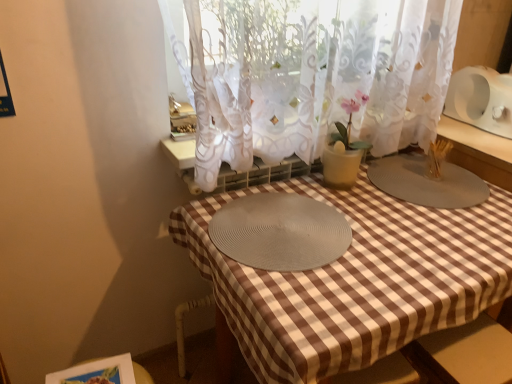
Find the location of `white sheer curtain at center`. white sheer curtain at center is located at coordinates (314, 75).

Is gray matte placemat at center, the first glass plate positioned from the right, closer to the viewer compared to gray woven placemat at center, placed as the second glass plate when sorted from right to left?

No, gray matte placemat at center, the first glass plate positioned from the right, is further to the viewer.

From the image's perspective, is gray matte placemat at center, which ranks as the second glass plate in left-to-right order, located above gray woven placemat at center, positioned as the 1th glass plate in left-to-right order?

Yes.

Which object is thinner, gray matte placemat at center, which ranks as the second glass plate in left-to-right order, or gray woven placemat at center, positioned as the 1th glass plate in left-to-right order?

gray woven placemat at center, positioned as the 1th glass plate in left-to-right order, is thinner.

Locate an element on the screen. glass plate behind the gray woven placemat at center, placed as the second glass plate when sorted from right to left is located at coordinates (426, 182).

Is gray matte placemat at center, which ranks as the second glass plate in left-to-right order, smaller than white sheer curtain at center?

Yes.

In terms of width, does gray matte placemat at center, the first glass plate positioned from the right, look wider or thinner when compared to white sheer curtain at center?

In the image, gray matte placemat at center, the first glass plate positioned from the right, appears to be wider than white sheer curtain at center.

Based on the photo, is gray matte placemat at center, which ranks as the second glass plate in left-to-right order, located outside white sheer curtain at center?

Yes, gray matte placemat at center, which ranks as the second glass plate in left-to-right order, is not within white sheer curtain at center.

Consider the image. From the image's perspective, is gray matte placemat at center, which ranks as the second glass plate in left-to-right order, under white sheer curtain at center?

Yes, from the image's perspective, gray matte placemat at center, which ranks as the second glass plate in left-to-right order, is beneath white sheer curtain at center.

Can you confirm if white sheer curtain at center is taller than gray woven placemat at center, placed as the second glass plate when sorted from right to left?

Indeed, white sheer curtain at center has a greater height compared to gray woven placemat at center, placed as the second glass plate when sorted from right to left.

Image resolution: width=512 pixels, height=384 pixels. I want to click on glass plate on the left of the white sheer curtain at center, so click(280, 232).

In the image, is white sheer curtain at center positioned in front of or behind gray woven placemat at center, placed as the second glass plate when sorted from right to left?

white sheer curtain at center is in front of gray woven placemat at center, placed as the second glass plate when sorted from right to left.

Is gray woven placemat at center, positioned as the 1th glass plate in left-to-right order, completely or partially inside white sheer curtain at center?

No, white sheer curtain at center does not contain gray woven placemat at center, positioned as the 1th glass plate in left-to-right order.

Which object is closer to the camera taking this photo, white sheer curtain at center or gray matte placemat at center, the first glass plate positioned from the right?

white sheer curtain at center is closer to the camera.

Is white sheer curtain at center facing towards gray matte placemat at center, the first glass plate positioned from the right?

Yes.

In terms of width, does white sheer curtain at center look wider or thinner when compared to gray matte placemat at center, which ranks as the second glass plate in left-to-right order?

Clearly, white sheer curtain at center has less width compared to gray matte placemat at center, which ranks as the second glass plate in left-to-right order.

Measure the distance from white sheer curtain at center to gray matte placemat at center, which ranks as the second glass plate in left-to-right order.

The distance of white sheer curtain at center from gray matte placemat at center, which ranks as the second glass plate in left-to-right order, is 13.70 inches.

Looking at this image, from the image's perspective, would you say gray woven placemat at center, positioned as the 1th glass plate in left-to-right order, is shown under white sheer curtain at center?

Yes, from the image's perspective, gray woven placemat at center, positioned as the 1th glass plate in left-to-right order, is beneath white sheer curtain at center.

This screenshot has width=512, height=384. What are the coordinates of `curtain in front of the gray woven placemat at center, placed as the second glass plate when sorted from right to left` in the screenshot? It's located at (314, 75).

Does gray woven placemat at center, placed as the second glass plate when sorted from right to left, come behind white sheer curtain at center?

Yes, it is.

Does gray woven placemat at center, placed as the second glass plate when sorted from right to left, have a lesser width compared to gray matte placemat at center, the first glass plate positioned from the right?

Correct, the width of gray woven placemat at center, placed as the second glass plate when sorted from right to left, is less than that of gray matte placemat at center, the first glass plate positioned from the right.

Considering the relative sizes of gray woven placemat at center, placed as the second glass plate when sorted from right to left, and gray matte placemat at center, the first glass plate positioned from the right, in the image provided, is gray woven placemat at center, placed as the second glass plate when sorted from right to left, bigger than gray matte placemat at center, the first glass plate positioned from the right,?

No, gray woven placemat at center, placed as the second glass plate when sorted from right to left, is not bigger than gray matte placemat at center, the first glass plate positioned from the right.

The image size is (512, 384). I want to click on glass plate below the gray matte placemat at center, which ranks as the second glass plate in left-to-right order (from the image's perspective), so click(x=280, y=232).

From the image's perspective, which is below, gray woven placemat at center, placed as the second glass plate when sorted from right to left, or gray matte placemat at center, which ranks as the second glass plate in left-to-right order?

gray woven placemat at center, placed as the second glass plate when sorted from right to left, appears lower in the image.

In order to click on glass plate below the gray matte placemat at center, which ranks as the second glass plate in left-to-right order (from a real-world perspective) in this screenshot , I will do `click(280, 232)`.

Image resolution: width=512 pixels, height=384 pixels. I want to click on curtain above the gray matte placemat at center, the first glass plate positioned from the right (from the image's perspective), so click(x=314, y=75).

Consider the image. Which object lies further to the anchor point white sheer curtain at center, gray woven placemat at center, positioned as the 1th glass plate in left-to-right order, or gray matte placemat at center, the first glass plate positioned from the right?

Based on the image, gray matte placemat at center, the first glass plate positioned from the right, appears to be further to white sheer curtain at center.

From the image, which object appears to be farther from gray woven placemat at center, positioned as the 1th glass plate in left-to-right order, gray matte placemat at center, which ranks as the second glass plate in left-to-right order, or white sheer curtain at center?

gray matte placemat at center, which ranks as the second glass plate in left-to-right order.

Based on their spatial positions, is white sheer curtain at center or gray matte placemat at center, which ranks as the second glass plate in left-to-right order, closer to gray woven placemat at center, positioned as the 1th glass plate in left-to-right order?

The object closer to gray woven placemat at center, positioned as the 1th glass plate in left-to-right order, is white sheer curtain at center.

Estimate the real-world distances between objects in this image. Which object is closer to white sheer curtain at center, gray matte placemat at center, the first glass plate positioned from the right, or gray woven placemat at center, positioned as the 1th glass plate in left-to-right order?

gray woven placemat at center, positioned as the 1th glass plate in left-to-right order, lies closer to white sheer curtain at center than the other object.

Based on their spatial positions, is white sheer curtain at center or gray woven placemat at center, positioned as the 1th glass plate in left-to-right order, closer to gray matte placemat at center, which ranks as the second glass plate in left-to-right order?

Among the two, white sheer curtain at center is located nearer to gray matte placemat at center, which ranks as the second glass plate in left-to-right order.

Estimate the real-world distances between objects in this image. Which object is further from gray matte placemat at center, the first glass plate positioned from the right, gray woven placemat at center, placed as the second glass plate when sorted from right to left, or white sheer curtain at center?

The object further to gray matte placemat at center, the first glass plate positioned from the right, is gray woven placemat at center, placed as the second glass plate when sorted from right to left.

At what (x,y) coordinates should I click in order to perform the action: click on curtain between gray woven placemat at center, positioned as the 1th glass plate in left-to-right order, and gray matte placemat at center, which ranks as the second glass plate in left-to-right order, in the horizontal direction. Please return your answer as a coordinate pair (x, y). Looking at the image, I should click on (314, 75).